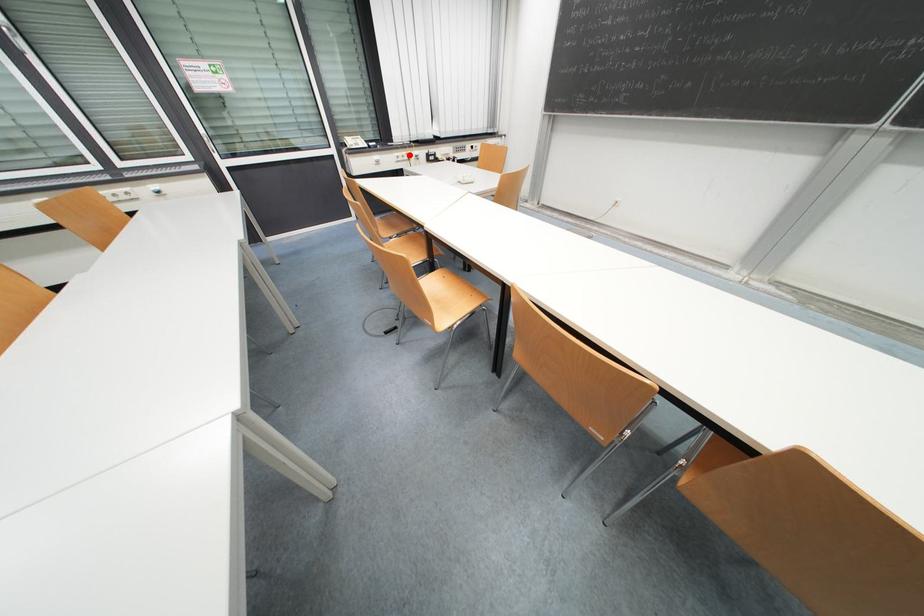
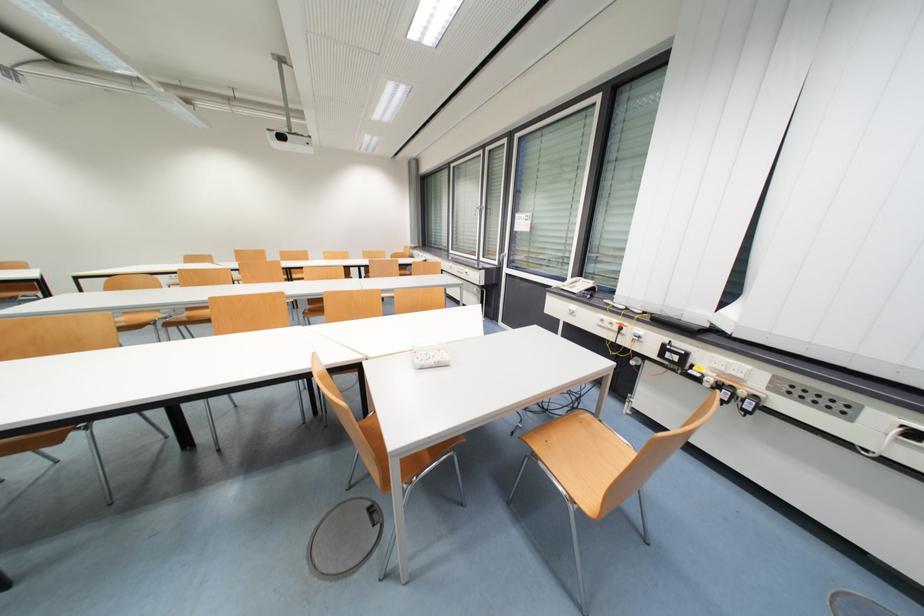
Find the pixel in the second image that matches the highlighted location in the first image.

(622, 323)